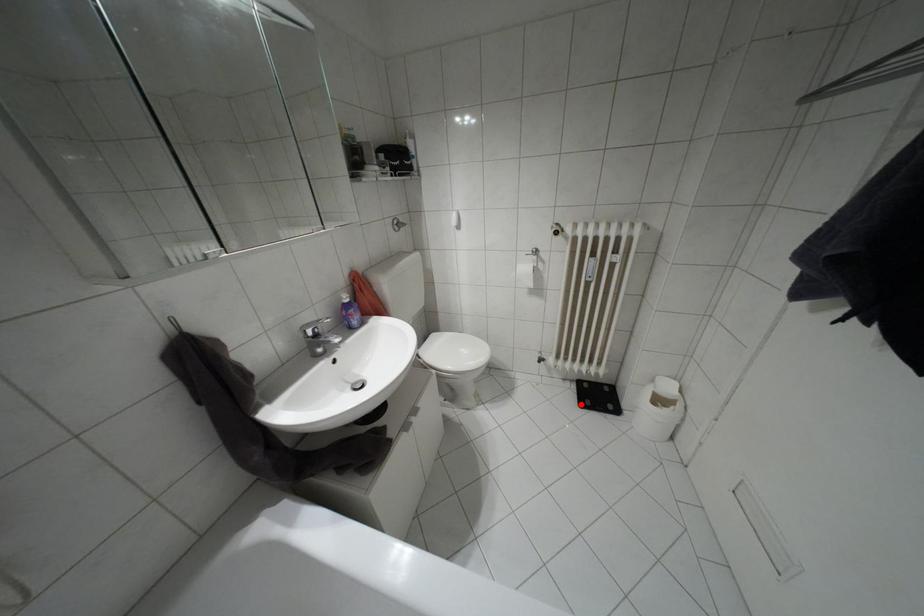
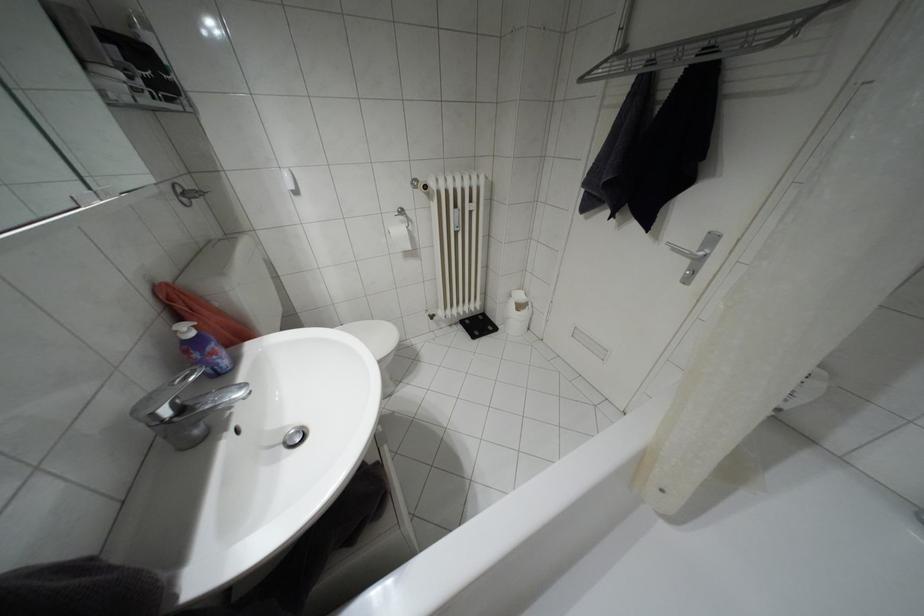
Question: A red point is marked in image1. In image2, is the corresponding 3D point closer to the camera or farther? Reply with the corresponding letter.

Choices:
 (A) The corresponding 3D point is closer.
 (B) The corresponding 3D point is farther.

Answer: (A)